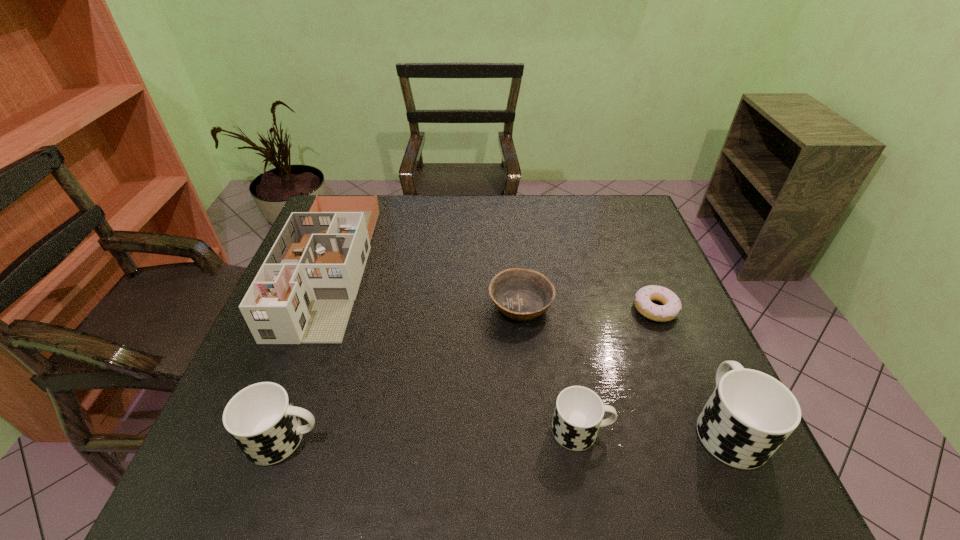
Where is `vacant space situated 0.210m on the side of the rightmost cup with the handle`? vacant space situated 0.210m on the side of the rightmost cup with the handle is located at coordinates (678, 318).

In order to click on free location located 0.230m on the side of the rightmost cup with the handle in this screenshot , I will do tap(675, 312).

The height and width of the screenshot is (540, 960). Find the location of `vacant region located 0.190m at the entrance of the dollhouse`. vacant region located 0.190m at the entrance of the dollhouse is located at coordinates (272, 416).

You are a GUI agent. You are given a task and a screenshot of the screen. Output one action in this format:
    pyautogui.click(x=<x>, y=<y>)
    Task: Click on the free space located on the front of the second shortest object
    This screenshot has width=960, height=540.
    Given the screenshot: What is the action you would take?
    pyautogui.click(x=528, y=378)

Locate an element on the screen. vacant space situated 0.210m on the front of the doughnut is located at coordinates pyautogui.click(x=691, y=399).

You are a GUI agent. You are given a task and a screenshot of the screen. Output one action in this format:
    pyautogui.click(x=<x>, y=<y>)
    Task: Click on the object that is at the far edge
    The width and height of the screenshot is (960, 540).
    Given the screenshot: What is the action you would take?
    pyautogui.click(x=304, y=291)

The width and height of the screenshot is (960, 540). I want to click on cup that is at the left edge, so click(x=261, y=419).

You are a GUI agent. You are given a task and a screenshot of the screen. Output one action in this format:
    pyautogui.click(x=<x>, y=<y>)
    Task: Click on the dollhouse that is at the left edge
    
    Given the screenshot: What is the action you would take?
    pyautogui.click(x=304, y=291)

Find the location of `cup that is at the right edge`. cup that is at the right edge is located at coordinates (749, 415).

I want to click on doughnut that is at the right edge, so click(x=671, y=306).